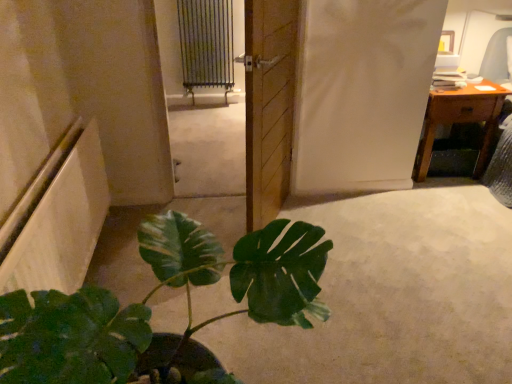
Question: Is green matte plant at lower left wider than wooden desk at upper right?

Choices:
 (A) yes
 (B) no

Answer: (A)

Question: Is green matte plant at lower left bigger than wooden desk at upper right?

Choices:
 (A) yes
 (B) no

Answer: (A)

Question: From the image's perspective, is green matte plant at lower left beneath wooden desk at upper right?

Choices:
 (A) yes
 (B) no

Answer: (A)

Question: Is green matte plant at lower left aimed at wooden desk at upper right?

Choices:
 (A) yes
 (B) no

Answer: (B)

Question: From the image's perspective, is green matte plant at lower left on top of wooden desk at upper right?

Choices:
 (A) yes
 (B) no

Answer: (B)

Question: Considering the positions of metallic radiator at upper center and green matte plant at lower left in the image, is metallic radiator at upper center taller or shorter than green matte plant at lower left?

Choices:
 (A) tall
 (B) short

Answer: (A)

Question: Considering the positions of point (214, 39) and point (287, 299), is point (214, 39) closer or farther from the camera than point (287, 299)?

Choices:
 (A) closer
 (B) farther

Answer: (B)

Question: Considering their positions, is metallic radiator at upper center located in front of or behind green matte plant at lower left?

Choices:
 (A) behind
 (B) front

Answer: (A)

Question: Visually, is metallic radiator at upper center positioned to the left or to the right of green matte plant at lower left?

Choices:
 (A) right
 (B) left

Answer: (B)

Question: From the image's perspective, is metallic radiator at upper center positioned above or below wooden door at center?

Choices:
 (A) above
 (B) below

Answer: (A)

Question: Is metallic radiator at upper center spatially inside wooden door at center, or outside of it?

Choices:
 (A) inside
 (B) outside

Answer: (B)

Question: Looking at the image, does metallic radiator at upper center seem bigger or smaller compared to wooden door at center?

Choices:
 (A) small
 (B) big

Answer: (A)

Question: From a real-world perspective, relative to wooden door at center, is metallic radiator at upper center vertically above or below?

Choices:
 (A) below
 (B) above

Answer: (A)

Question: Is point (148, 226) closer or farther from the camera than point (479, 84)?

Choices:
 (A) farther
 (B) closer

Answer: (B)

Question: Considering their positions, is green matte plant at lower left located in front of or behind wooden desk at upper right?

Choices:
 (A) behind
 (B) front

Answer: (B)